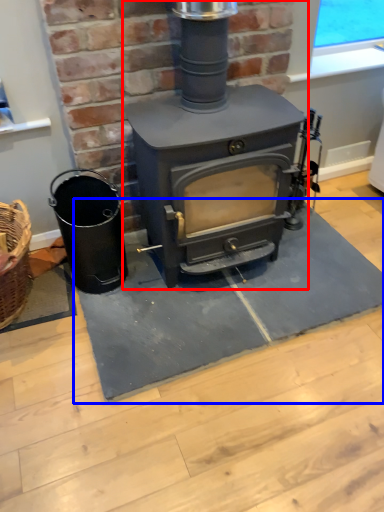
Question: Which object is further to the camera taking this photo, wood burning stove (highlighted by a red box) or doormat (highlighted by a blue box)?

Choices:
 (A) wood burning stove
 (B) doormat

Answer: (B)